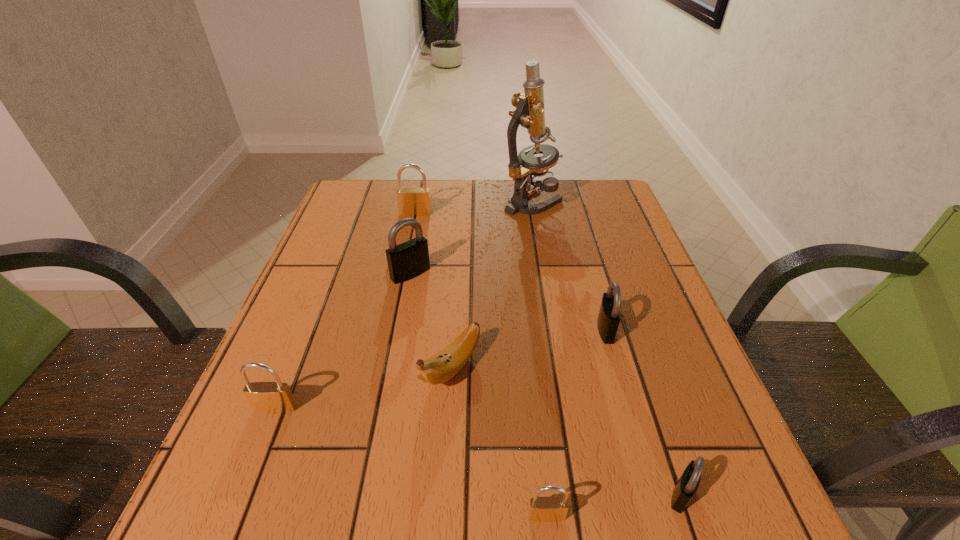
Locate an element on the screen. This screenshot has width=960, height=540. the fourth object from left to right is located at coordinates [441, 367].

Where is `the rightmost padlock`? the rightmost padlock is located at coordinates (686, 487).

Identify the location of the nearest black padlock. (686, 487).

The width and height of the screenshot is (960, 540). What are the coordinates of `the smallest brass padlock` in the screenshot? It's located at (541, 509).

Identify the location of the nearest brass padlock. (541, 509).

Identify the location of blank space located on the front of the tallest object. This screenshot has width=960, height=540. (546, 283).

Identify the location of blank space located on the front-facing side of the farthest padlock. (408, 247).

In order to click on vacant space located 0.270m on the back of the farthest black padlock in this screenshot , I will do `click(423, 204)`.

At what (x,y) coordinates should I click in order to perform the action: click on blank space located on the left of the fifth padlock from left to right. Please return your answer as a coordinate pair (x, y). Looking at the image, I should click on (540, 329).

Image resolution: width=960 pixels, height=540 pixels. What are the coordinates of `free location located 0.100m on the front-facing side of the second nearest brass padlock` in the screenshot? It's located at (251, 471).